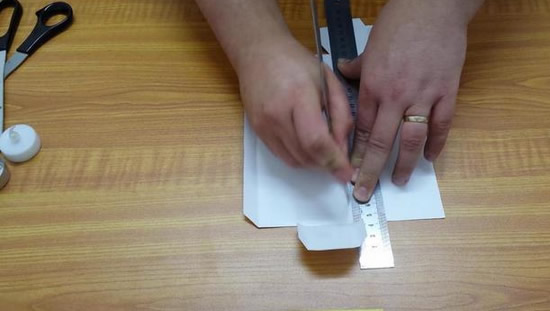
Image resolution: width=550 pixels, height=311 pixels. In order to click on wooden tabletop in this screenshot , I will do `click(170, 226)`.